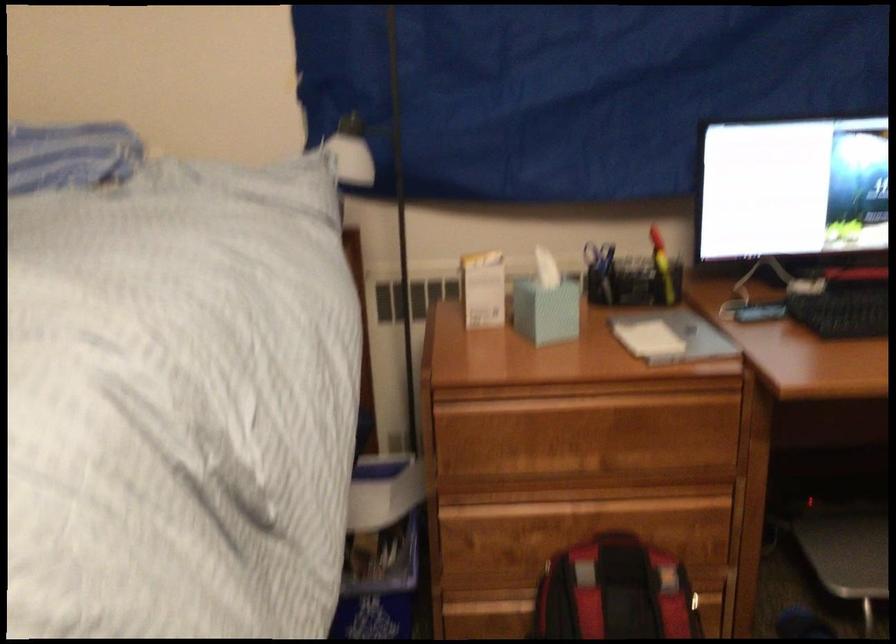
The location [615,592] corresponds to which object?

It refers to a red and black backpack.